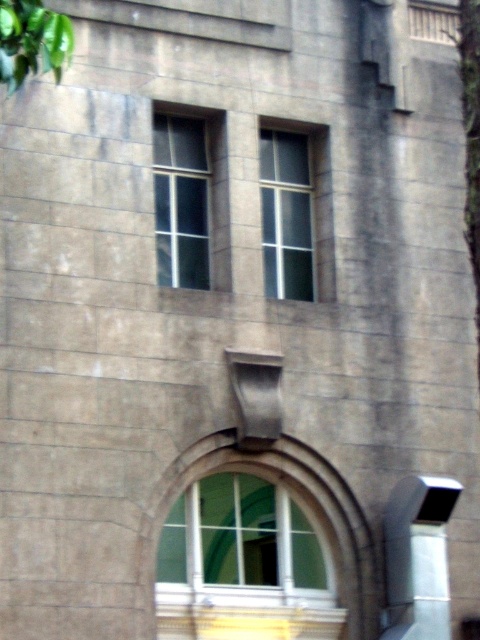
Is point (255, 528) farther from camera compared to point (192, 253)?

That is False.

Can you confirm if green glass window at center is smaller than clear glass window at upper center?

No, green glass window at center is not smaller than clear glass window at upper center.

Identify the location of green glass window at center. (239, 540).

Find the location of `green glass window at center`. green glass window at center is located at coordinates (239, 540).

Which of these two, clear glass window at upper center or clear glass window at center, stands taller?

Standing taller between the two is clear glass window at center.

Can you confirm if clear glass window at upper center is thinner than clear glass window at center?

In fact, clear glass window at upper center might be wider than clear glass window at center.

You are a GUI agent. You are given a task and a screenshot of the screen. Output one action in this format:
    pyautogui.click(x=<x>, y=<y>)
    Task: Click on the clear glass window at upper center
    This screenshot has height=640, width=480.
    Given the screenshot: What is the action you would take?
    pyautogui.click(x=191, y=200)

Is clear glass window at center wider than green leafy tree at upper left?

Yes, clear glass window at center is wider than green leafy tree at upper left.

Can you confirm if clear glass window at center is thinner than green leafy tree at upper left?

No, clear glass window at center is not thinner than green leafy tree at upper left.

Which is in front, point (311, 186) or point (48, 29)?

Point (48, 29) is more forward.

Find the location of a particular element. This screenshot has height=640, width=480. clear glass window at center is located at coordinates (296, 212).